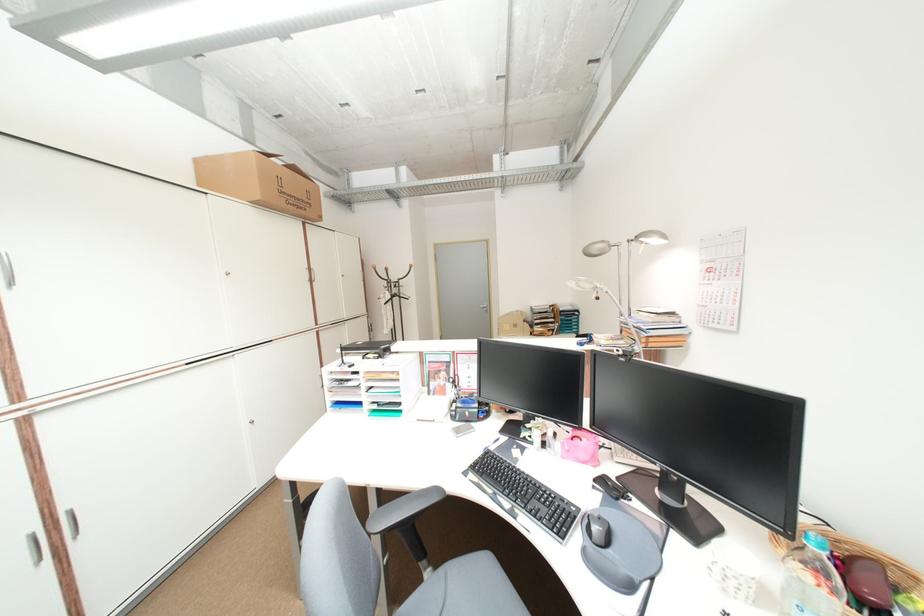
The height and width of the screenshot is (616, 924). I want to click on coat rack hook, so click(x=392, y=301).